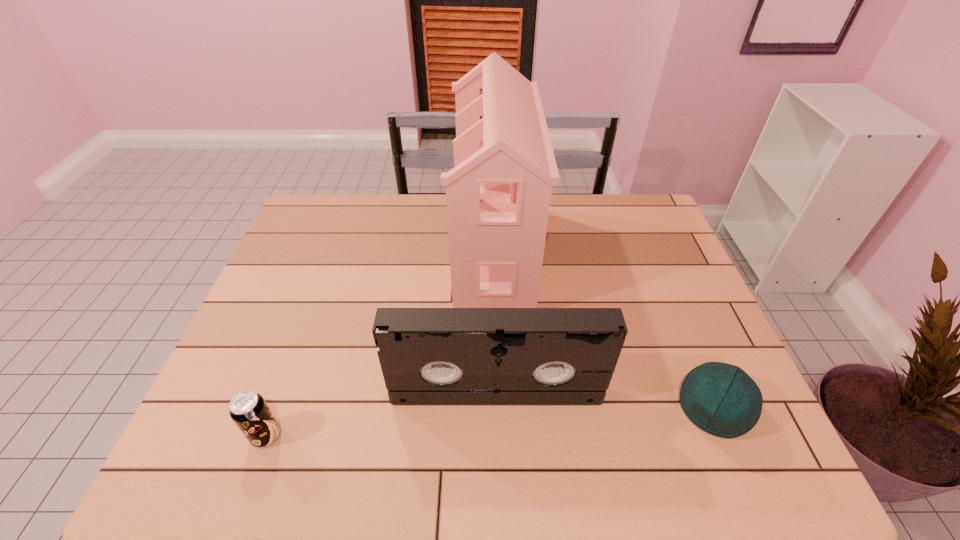
The height and width of the screenshot is (540, 960). What are the coordinates of `vacant space at the far right corner of the desktop` in the screenshot? It's located at (631, 223).

You are a GUI agent. You are given a task and a screenshot of the screen. Output one action in this format:
    pyautogui.click(x=<x>, y=<y>)
    Task: Click on the vacant space in between the videotape and the soda can
    
    Given the screenshot: What is the action you would take?
    pyautogui.click(x=381, y=414)

Find the location of `unoccupied position between the leftmost object and the rightmost object`. unoccupied position between the leftmost object and the rightmost object is located at coordinates (490, 421).

At what (x,y) coordinates should I click in order to perform the action: click on empty location between the videotape and the leftmost object. Please return your answer as a coordinate pair (x, y). Looking at the image, I should click on pos(381,414).

What are the coordinates of `free spot between the videotape and the leftmost object` in the screenshot? It's located at (381, 414).

Where is `free space between the leftmost object and the third shortest object`? The height and width of the screenshot is (540, 960). free space between the leftmost object and the third shortest object is located at coordinates (381, 414).

I want to click on vacant region between the rightmost object and the soda can, so click(x=490, y=421).

This screenshot has height=540, width=960. Find the location of `object that ranks as the second closest to the videotape`. object that ranks as the second closest to the videotape is located at coordinates (498, 194).

Select which object is the second closest to the soda can. Please provide its 2D coordinates. Your answer should be formatted as a tuple, i.e. [(x, y)], where the tuple contains the x and y coordinates of a point satisfying the conditions above.

[(498, 194)]

In order to click on vacant space that satisfies the following two spatial constraints: 1. on the front-facing side of the farthest object; 2. on the back side of the beanie in this screenshot , I will do `click(498, 408)`.